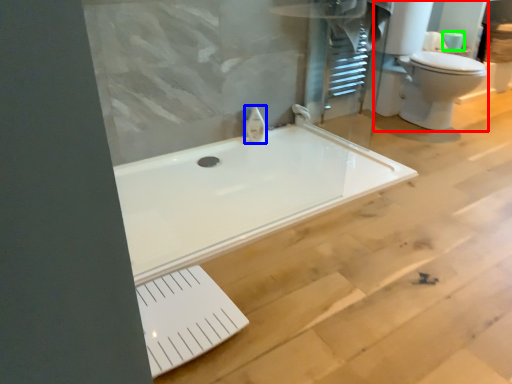
Question: Which object is the closest to the sink (highlighted by a red box)? Choose among these: faucet (highlighted by a blue box) or toilet paper (highlighted by a green box).

Choices:
 (A) faucet
 (B) toilet paper

Answer: (B)